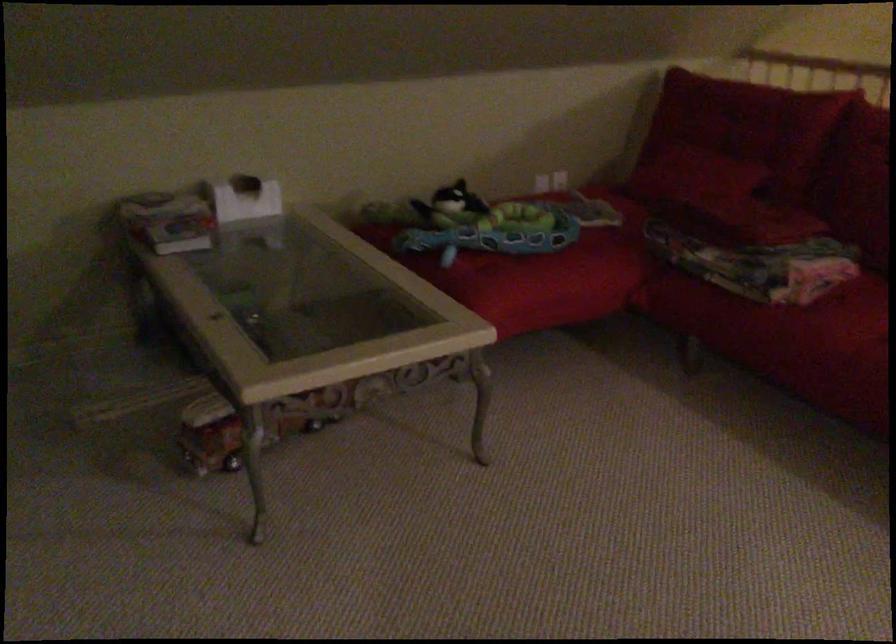
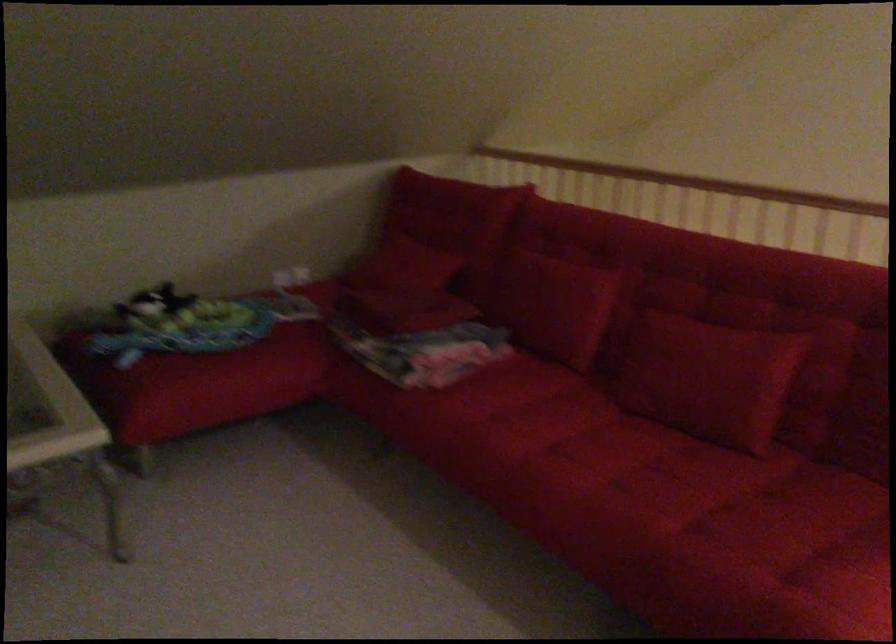
Question: The images are taken continuously from a first-person perspective. In which direction are you moving?

Choices:
 (A) Left
 (B) Right
 (C) Forward
 (D) Backward

Answer: (B)